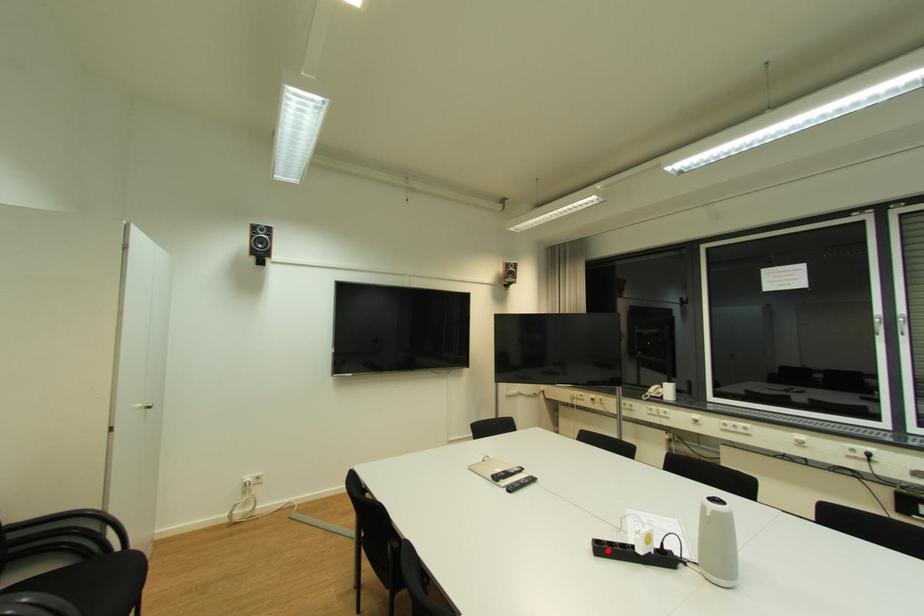
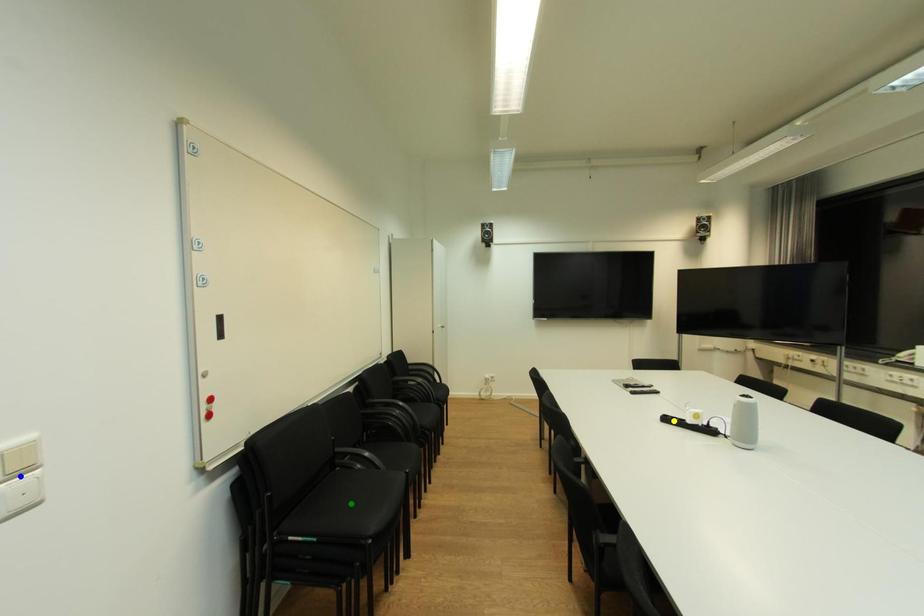
Question: I am providing you with two images of the same scene from different viewpoints. A red point is marked on the first image. You are given multiple points on the second image. Which point in image 2 is actually the same real-world point as the red point in image 1?

Choices:
 (A) blue point
 (B) yellow point
 (C) green point

Answer: (B)